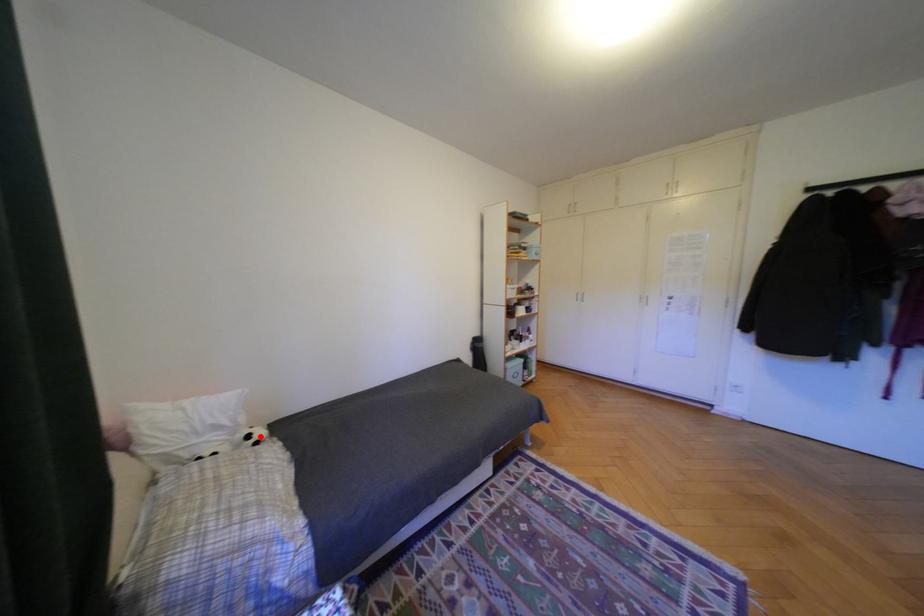
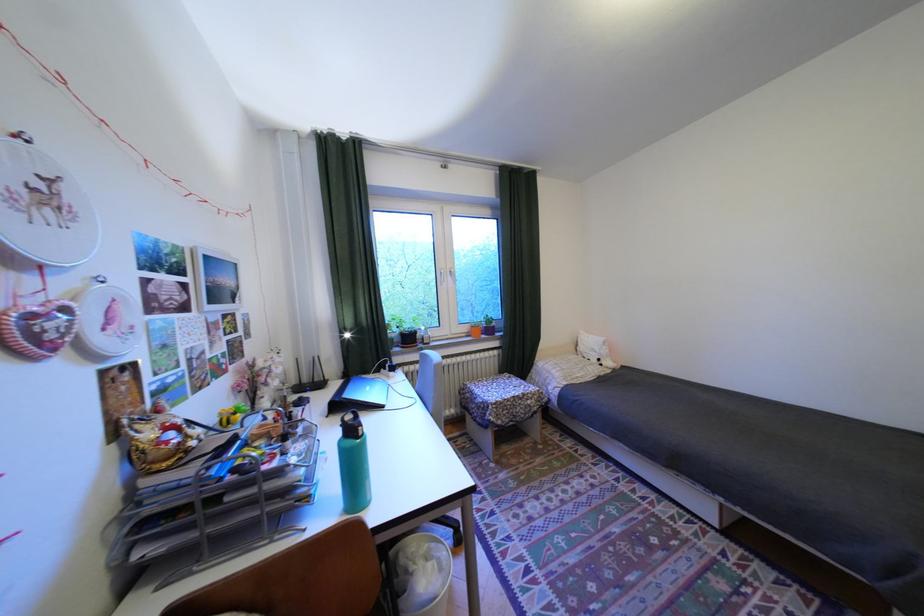
Question: I am providing you with two images of the same scene from different viewpoints. A red point is marked on the first image. Is the red point's position out of view in image 2?

Choices:
 (A) Yes
 (B) No

Answer: (B)